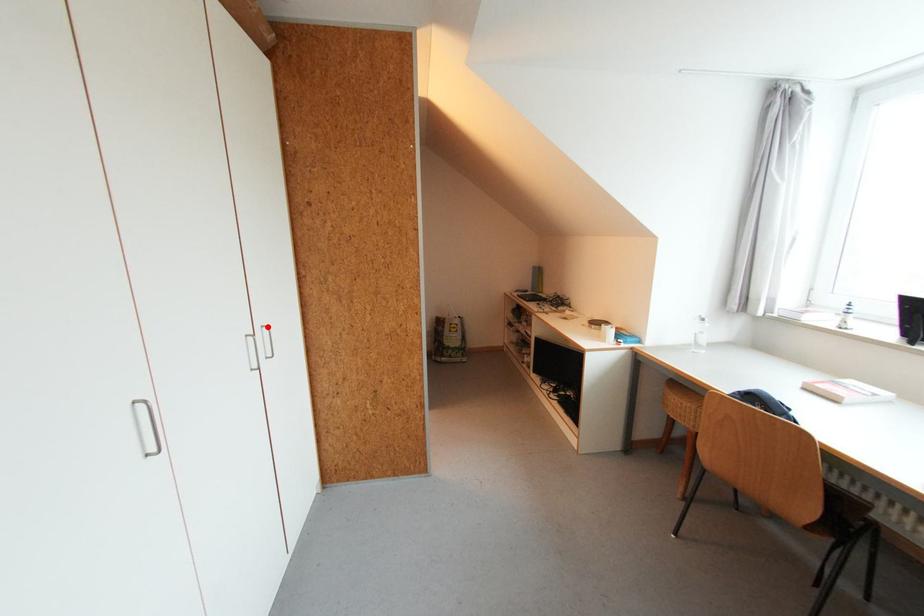
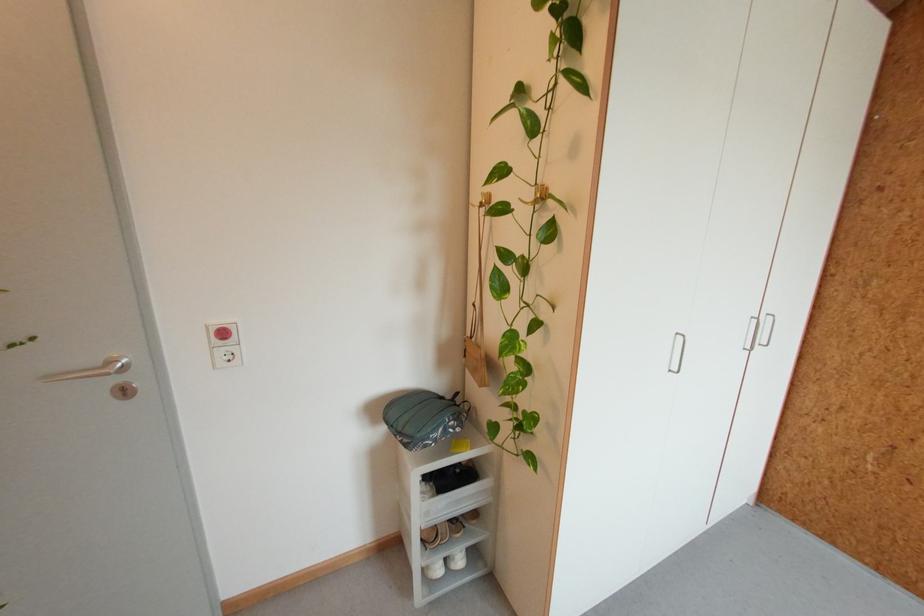
In the second image, find the point that corresponds to the highlighted location in the first image.

(772, 315)